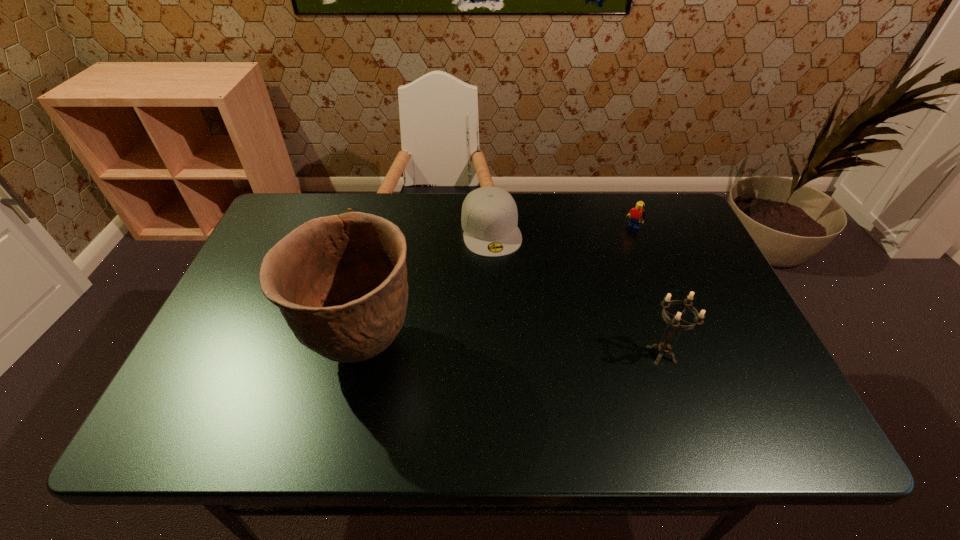
The image size is (960, 540). Identify the location of vacant region located on the front-facing side of the third object from left to right. (516, 343).

You are a GUI agent. You are given a task and a screenshot of the screen. Output one action in this format:
    pyautogui.click(x=<x>, y=<y>)
    Task: Click on the free location located 0.190m on the front-facing side of the Lego
    The height and width of the screenshot is (540, 960).
    Given the screenshot: What is the action you would take?
    pyautogui.click(x=604, y=274)

The height and width of the screenshot is (540, 960). I want to click on vacant area situated 0.240m on the front-facing side of the Lego, so click(595, 285).

You are a GUI agent. You are given a task and a screenshot of the screen. Output one action in this format:
    pyautogui.click(x=<x>, y=<y>)
    Task: Click on the blank space located on the front-facing side of the Lego
    
    Given the screenshot: What is the action you would take?
    pyautogui.click(x=577, y=308)

I want to click on free spot located on the front-facing side of the shortest object, so click(x=424, y=307).

Find the location of a particular element. The image size is (960, 540). free space located 0.110m on the front-facing side of the shortest object is located at coordinates (381, 272).

Where is `free space located on the front-facing side of the shortest object`? free space located on the front-facing side of the shortest object is located at coordinates (440, 321).

Identify the location of cap located in the far edge section of the desktop. The height and width of the screenshot is (540, 960). (489, 218).

The width and height of the screenshot is (960, 540). What are the coordinates of `Lego at the far edge` in the screenshot? It's located at (637, 215).

This screenshot has width=960, height=540. Find the location of `sunglasses that is positioned at the far edge`. sunglasses that is positioned at the far edge is located at coordinates (347, 208).